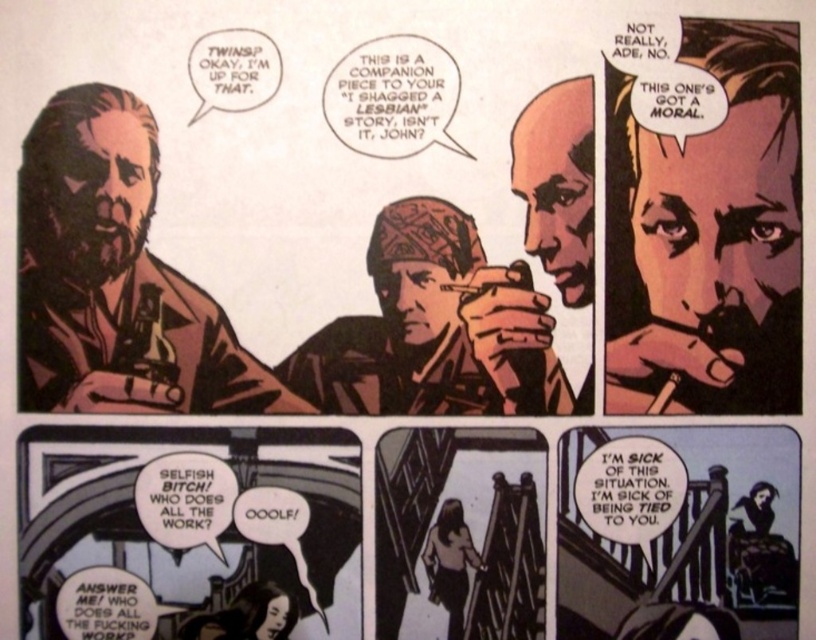
Question: Estimate the real-world distances between objects in this image. Which object is farther from the smooth wooden pipe at upper right?

Choices:
 (A) matte brown bandana at center
 (B) smooth skin face at upper right
 (C) matte brown leather jacket at left

Answer: (C)

Question: Estimate the real-world distances between objects in this image. Which object is closer to the smooth skin face at upper right?

Choices:
 (A) matte brown leather jacket at left
 (B) matte brown bandana at center

Answer: (B)

Question: Which point is farther to the camera?

Choices:
 (A) smooth wooden pipe at upper right
 (B) smooth skin face at upper right
 (C) matte brown bandana at center
 (D) matte brown leather jacket at left

Answer: (C)

Question: Does smooth wooden pipe at upper right appear on the right side of smooth skin face at upper right?

Choices:
 (A) no
 (B) yes

Answer: (B)

Question: Does matte brown leather jacket at left have a smaller size compared to matte brown bandana at center?

Choices:
 (A) no
 (B) yes

Answer: (A)

Question: In this image, where is smooth wooden pipe at upper right located relative to matte brown bandana at center?

Choices:
 (A) below
 (B) above

Answer: (B)